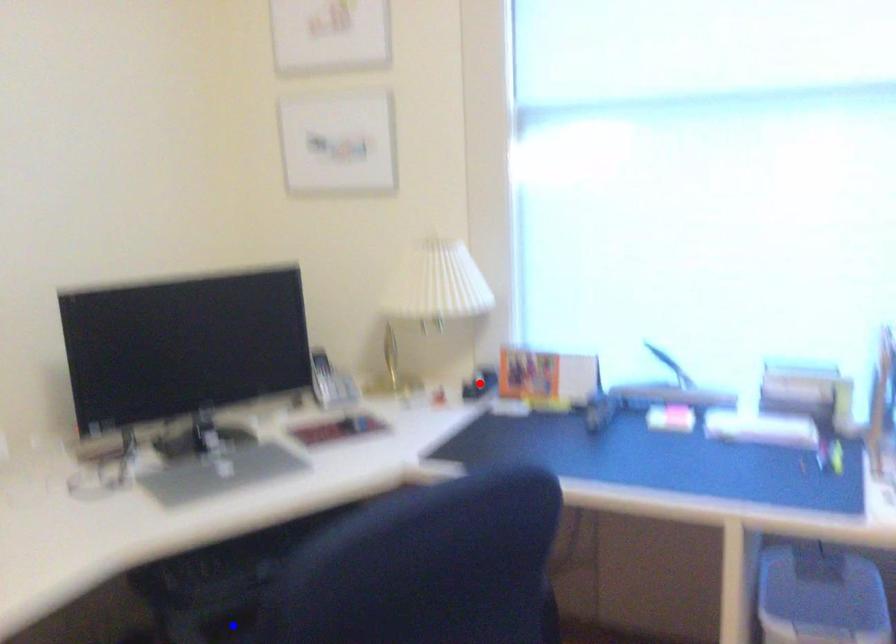
Question: Two points are marked on the image. Which point is closer to the camera?

Choices:
 (A) Blue point is closer.
 (B) Red point is closer.

Answer: (A)